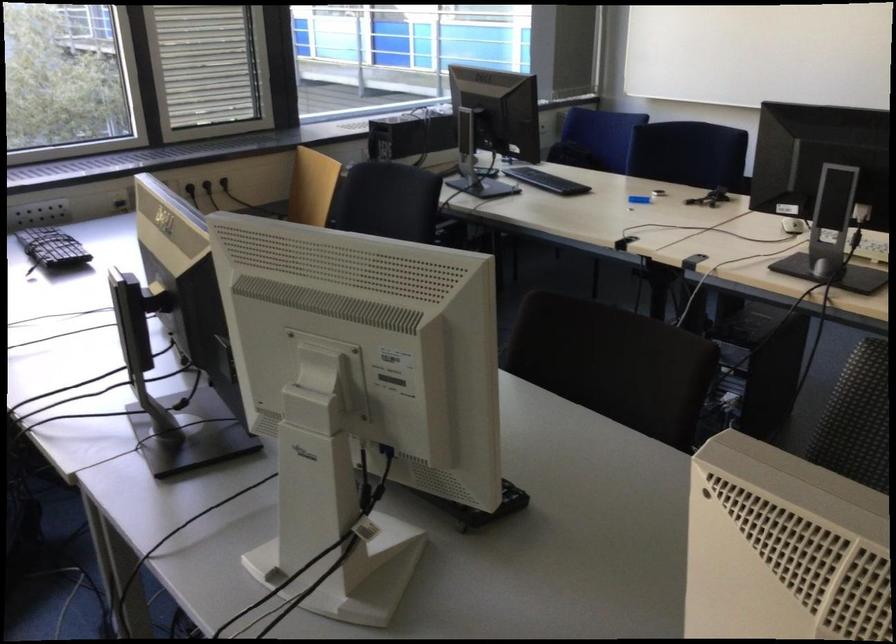
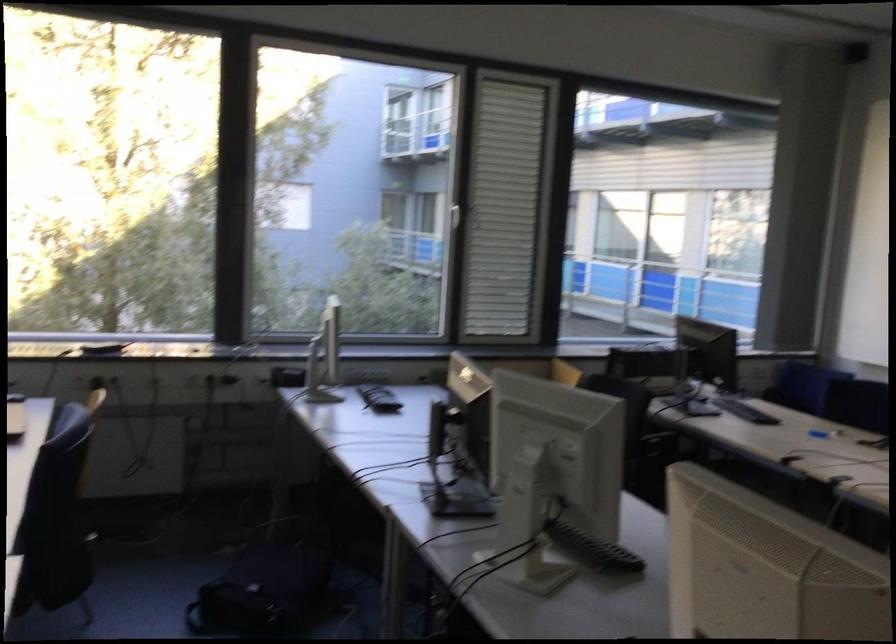
Where in the second image is the point corresponding to pixel 452 500 from the first image?

(592, 549)